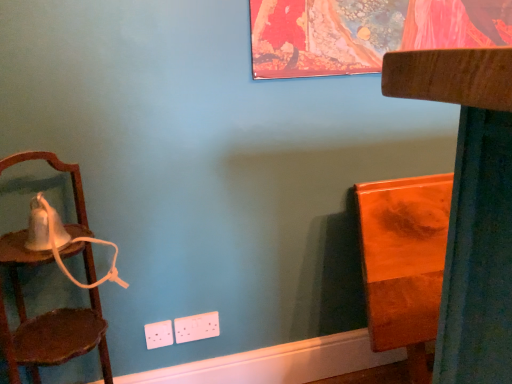
Question: From their relative heights in the image, would you say orange glossy wood at right, placed as the second furniture when sorted from front to back, is taller or shorter than wooden chair at right, the 2th furniture viewed from the back?

Choices:
 (A) tall
 (B) short

Answer: (B)

Question: In the image, is orange glossy wood at right, which is the 1th furniture in back-to-front order, on the left side or the right side of wooden chair at right, the 2th furniture viewed from the back?

Choices:
 (A) left
 (B) right

Answer: (B)

Question: Which is nearer to the wooden chair at right, the 2th furniture viewed from the back?

Choices:
 (A) orange glossy wood at right, placed as the second furniture when sorted from front to back
 (B) wooden chair at left

Answer: (A)

Question: Based on their relative distances, which object is farther from the wooden chair at left?

Choices:
 (A) orange glossy wood at right, placed as the second furniture when sorted from front to back
 (B) wooden chair at right, the 2th furniture viewed from the back

Answer: (B)